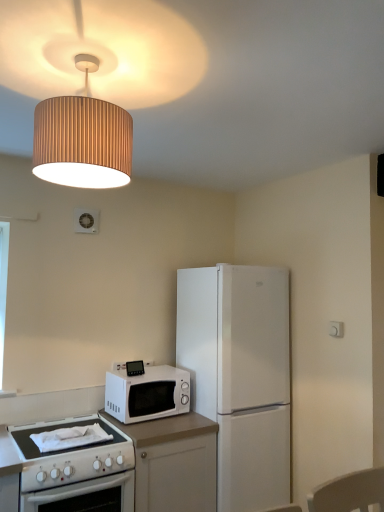
Question: Relative to white matte refrigerator at center-right, is white laminate countertop at lower left in front or behind?

Choices:
 (A) behind
 (B) front

Answer: (B)

Question: Based on their sizes in the image, would you say white laminate countertop at lower left is bigger or smaller than white matte refrigerator at center-right?

Choices:
 (A) big
 (B) small

Answer: (B)

Question: Based on their relative distances, which object is farther from the white matte refrigerator at center-right?

Choices:
 (A) white laminate countertop at lower left
 (B) wooden lampshade at upper center
 (C) white matte microwave at center

Answer: (B)

Question: Which object is positioned closest to the wooden lampshade at upper center?

Choices:
 (A) white laminate countertop at lower left
 (B) white matte microwave at center
 (C) white matte refrigerator at center-right

Answer: (C)